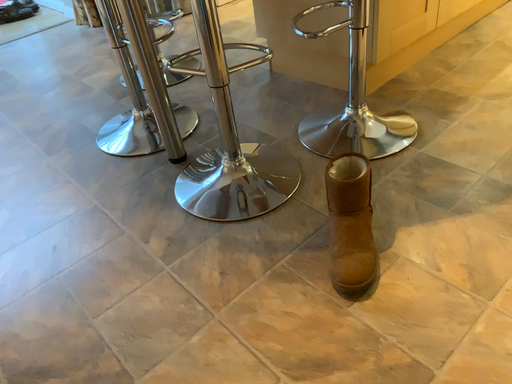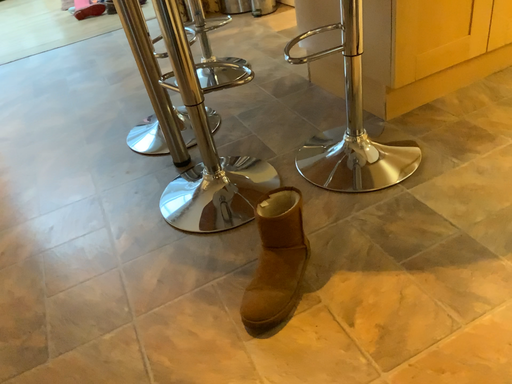
Question: Which way did the camera rotate in the video?

Choices:
 (A) rotated right
 (B) rotated left

Answer: (B)